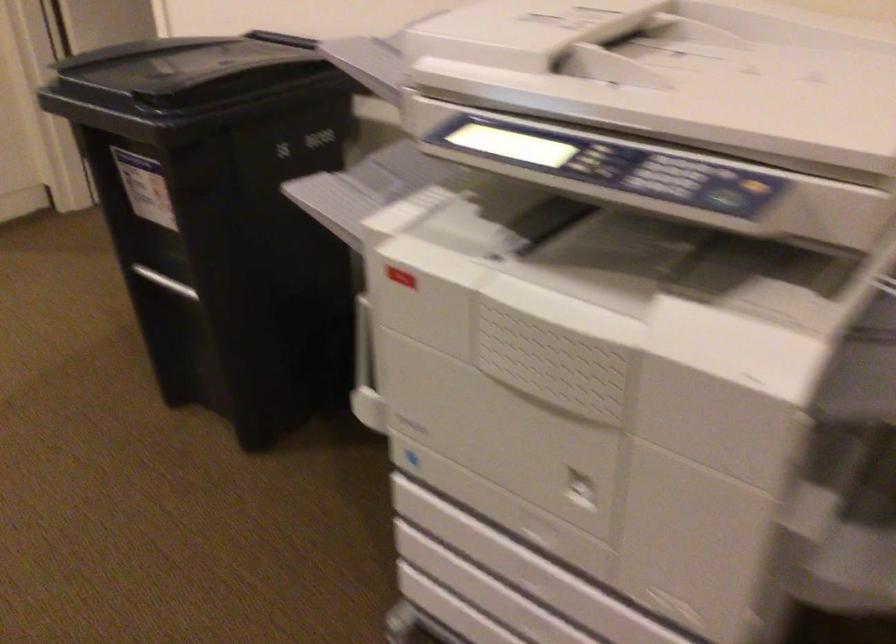
This screenshot has height=644, width=896. What do you see at coordinates (522, 30) in the screenshot? I see `a scanner lid` at bounding box center [522, 30].